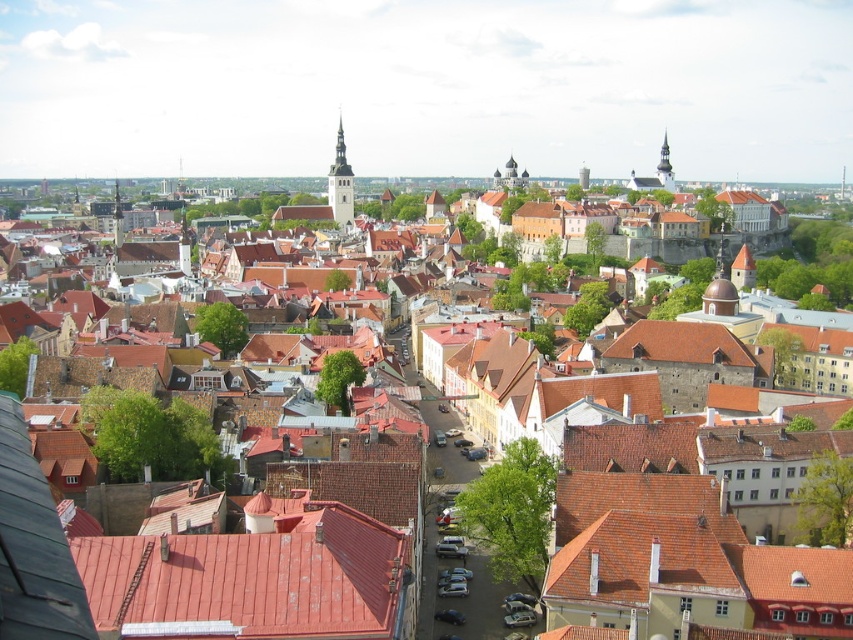
You are an architect analyzing the city layout. From your viewpoint, which object is located directly above the other between the red tile roof at center and the smooth stone tower at center?

The smooth stone tower at center is directly above the red tile roof at center because the red tile roof at center is positioned under it.

You are an architect analyzing the layout of this historic city. You notice the red tile roof at center and the smooth stone tower at upper right. Based on their positions, which direction would you need to look to see both structures simultaneously in your field of view?

To see both the red tile roof at center and the smooth stone tower at upper right simultaneously, you should look towards the left of the smooth stone tower at upper right since the red tile roof at center is positioned to its left.

You are a tourist standing on a hill overlooking the city. You notice the red tile roof at center and the smooth stone tower at upper right. Which structure appears taller from your vantage point?

The smooth stone tower at upper right appears taller than the red tile roof at center from your vantage point because the red tile roof at center is shorter than smooth stone tower at upper right.